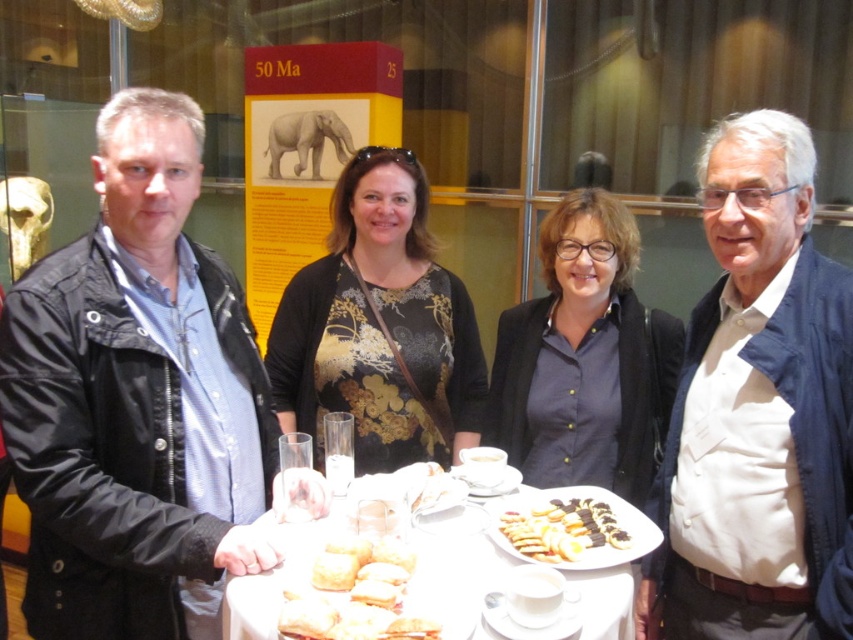
Question: Is black leather jacket at left closer to camera compared to golden brown flaky pastry at center?

Choices:
 (A) yes
 (B) no

Answer: (B)

Question: Does black floral dress at center come behind dark blue shirt at center?

Choices:
 (A) no
 (B) yes

Answer: (B)

Question: Which point appears farthest from the camera in this image?

Choices:
 (A) (804, 396)
 (B) (634, 435)
 (C) (467, 310)
 (D) (138, 120)

Answer: (C)

Question: Which object is positioned farthest from the black floral dress at center?

Choices:
 (A) dark blue shirt at center
 (B) white porcelain plate at center

Answer: (B)

Question: Which point is farther from the camera taking this photo?

Choices:
 (A) (744, 323)
 (B) (479, 625)

Answer: (A)

Question: Can you confirm if black leather jacket at left is positioned to the right of white porcelain plate at center?

Choices:
 (A) no
 (B) yes

Answer: (A)